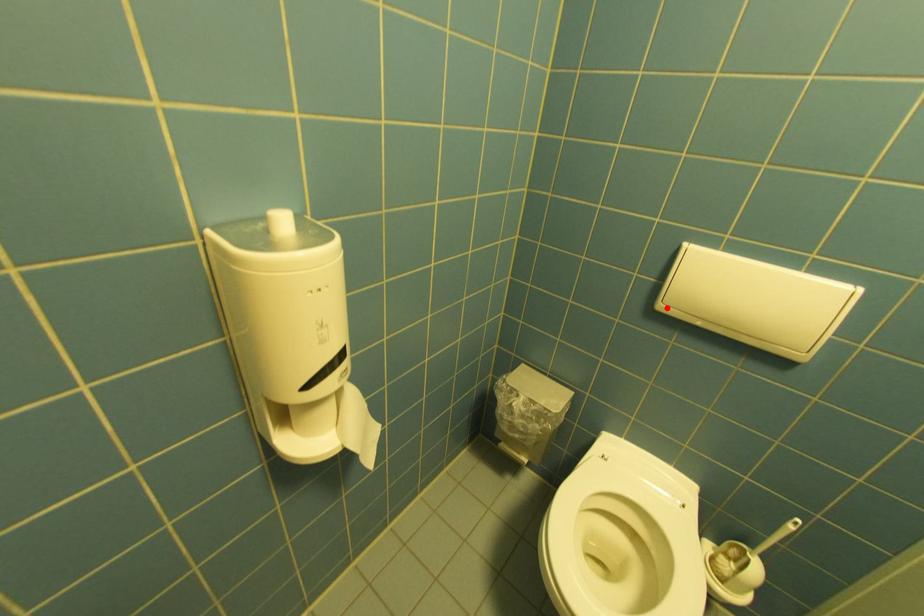
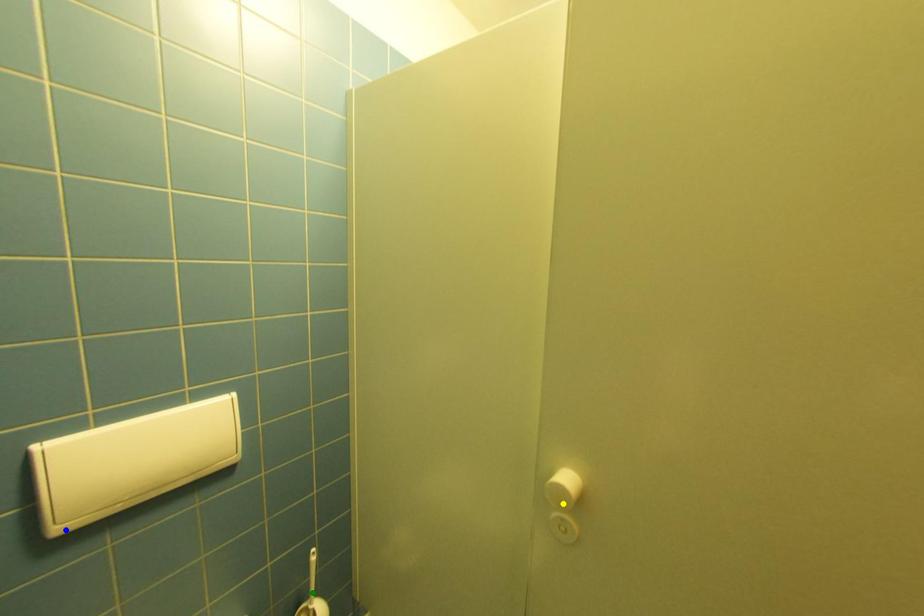
Question: I am providing you with two images of the same scene from different viewpoints. A red point is marked on the first image. You are given multiple points on the second image. Which point in image 2 is actually the same real-world point as the red point in image 1?

Choices:
 (A) green point
 (B) blue point
 (C) yellow point

Answer: (B)